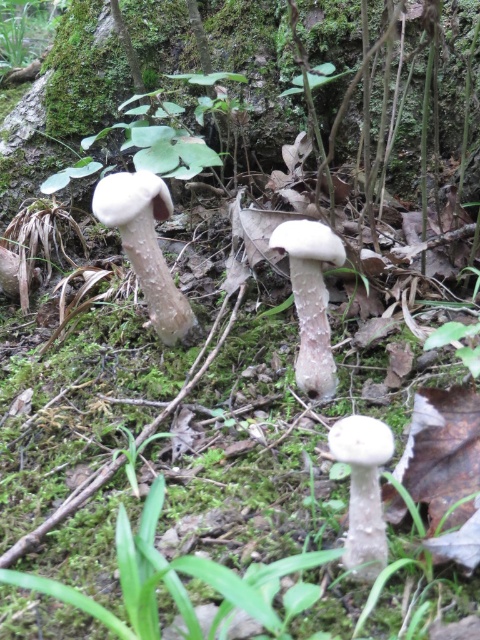
Question: Based on their relative distances, which object is farther from the white matte mushroom at left?

Choices:
 (A) white fuzzy mushroom at center
 (B) white matte mushroom at center

Answer: (B)

Question: Which point is farther to the camera?

Choices:
 (A) (312, 369)
 (B) (146, 225)
 (C) (352, 467)

Answer: (B)

Question: Does white matte mushroom at left appear under white matte mushroom at center?

Choices:
 (A) yes
 (B) no

Answer: (B)

Question: Considering the real-world distances, which object is farthest from the white matte mushroom at center?

Choices:
 (A) white matte mushroom at left
 (B) white fuzzy mushroom at center

Answer: (A)

Question: Is white fuzzy mushroom at center closer to camera compared to white matte mushroom at center?

Choices:
 (A) no
 (B) yes

Answer: (A)

Question: Does white matte mushroom at left appear over white fuzzy mushroom at center?

Choices:
 (A) yes
 (B) no

Answer: (A)